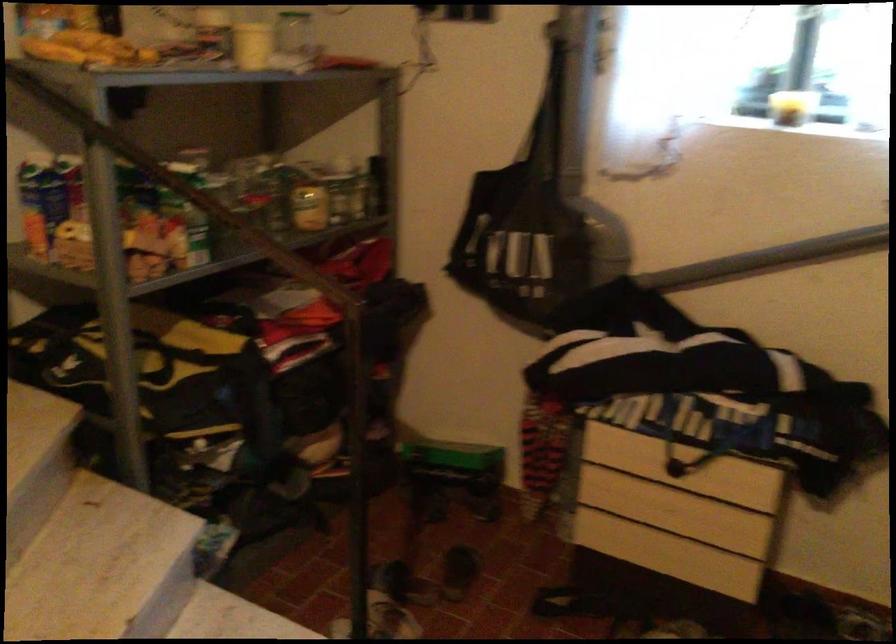
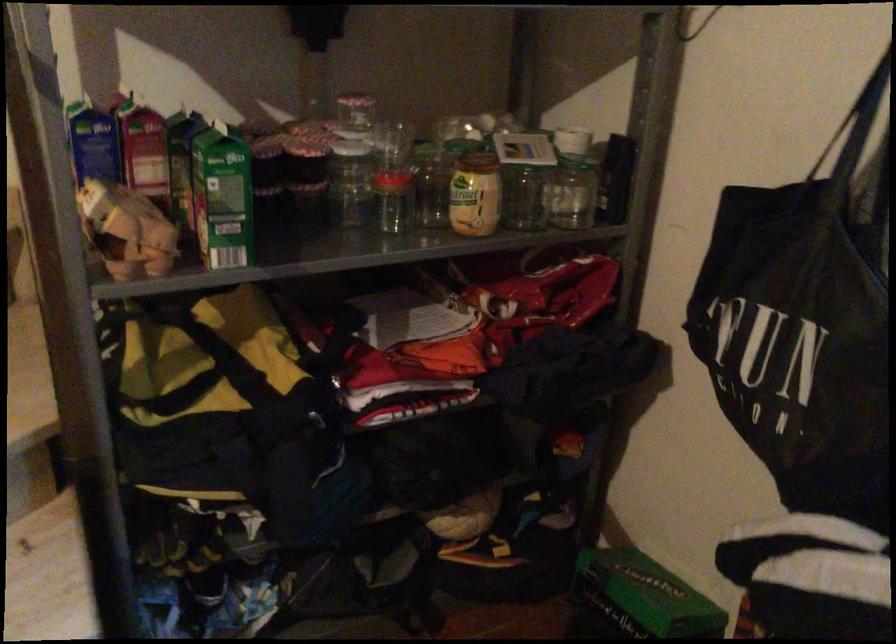
Question: The first image is from the beginning of the video and the second image is from the end. How did the camera likely rotate when shooting the video?

Choices:
 (A) Left
 (B) Right
 (C) Up
 (D) Down

Answer: (A)